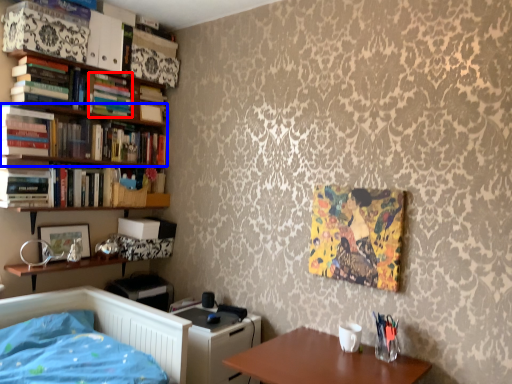
Question: Among these objects, which one is farthest to the camera, book (highlighted by a red box) or book (highlighted by a blue box)?

Choices:
 (A) book
 (B) book

Answer: (A)